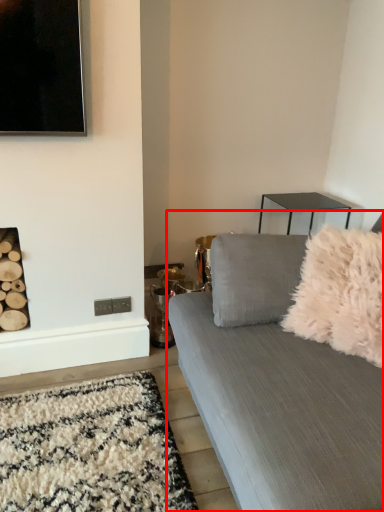
Question: From the image's perspective, where is studio couch (annotated by the red box) located in relation to throw pillow in the image?

Choices:
 (A) above
 (B) below

Answer: (B)